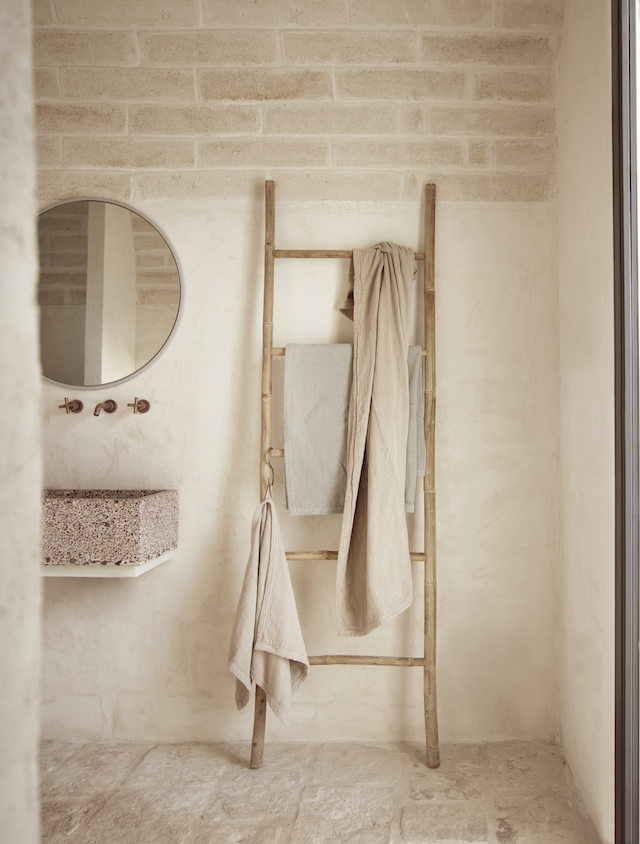
Where is `faucet`? This screenshot has width=640, height=844. faucet is located at coordinates (68, 403), (100, 406), (141, 408).